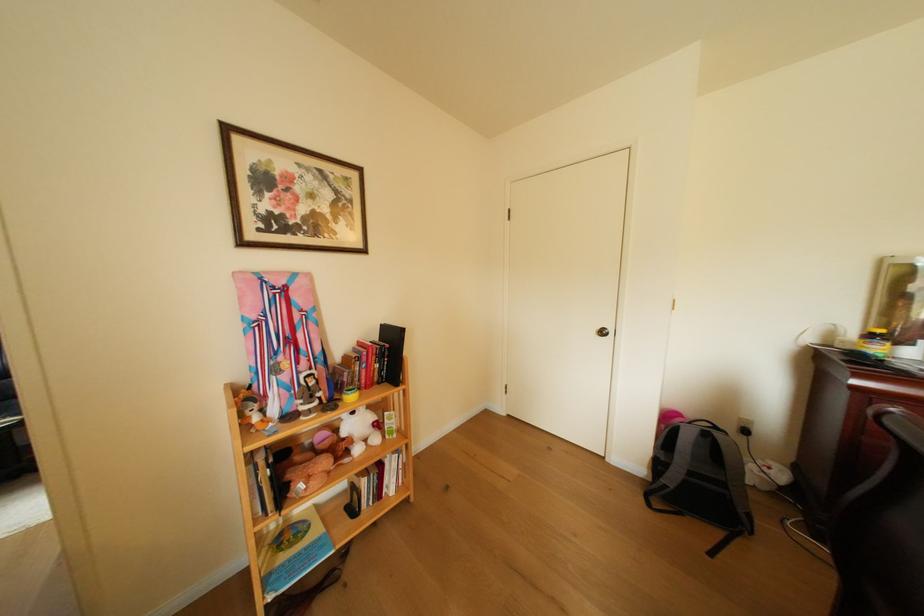
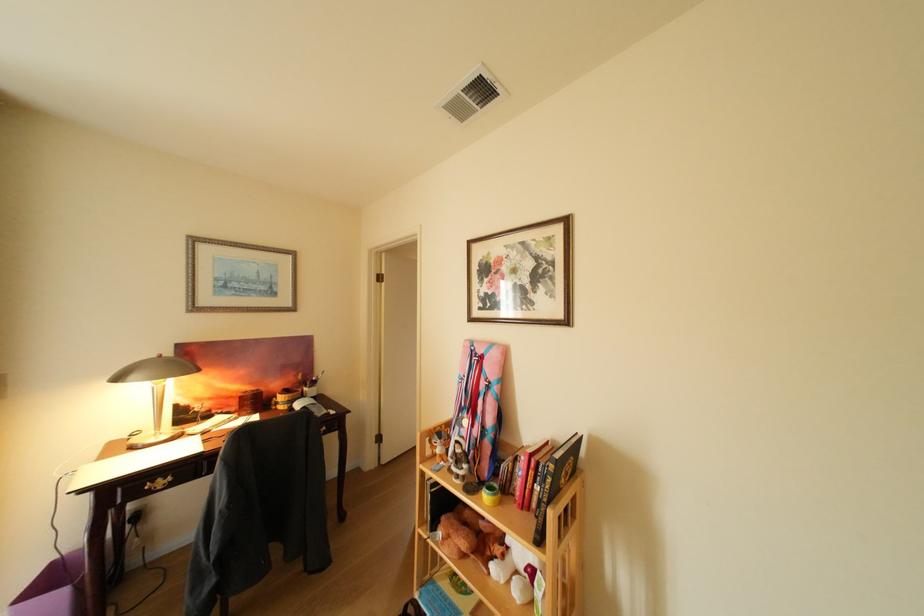
Where in the second image is the point corresponding to (x=367, y=374) from the first image?

(525, 475)